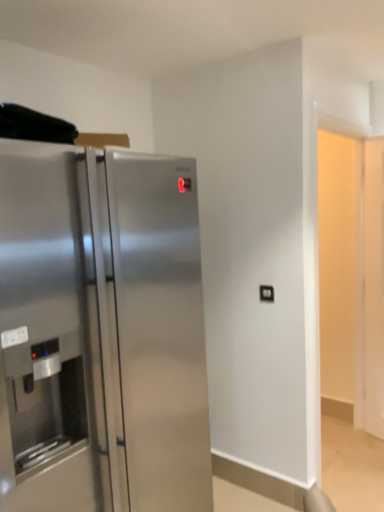
Question: In terms of width, does black plastic outlet at center look wider or thinner when compared to stainless steel refrigerator at left?

Choices:
 (A) wide
 (B) thin

Answer: (B)

Question: Is black plastic outlet at center inside the boundaries of stainless steel refrigerator at left, or outside?

Choices:
 (A) outside
 (B) inside

Answer: (A)

Question: From their relative heights in the image, would you say black plastic outlet at center is taller or shorter than stainless steel refrigerator at left?

Choices:
 (A) tall
 (B) short

Answer: (B)

Question: In terms of size, does stainless steel refrigerator at left appear bigger or smaller than black plastic outlet at center?

Choices:
 (A) small
 (B) big

Answer: (B)

Question: Is point [x=107, y=197] positioned closer to the camera than point [x=271, y=296]?

Choices:
 (A) closer
 (B) farther

Answer: (A)

Question: From their relative heights in the image, would you say stainless steel refrigerator at left is taller or shorter than black plastic outlet at center?

Choices:
 (A) tall
 (B) short

Answer: (A)

Question: Relative to black plastic outlet at center, is stainless steel refrigerator at left in front or behind?

Choices:
 (A) front
 (B) behind

Answer: (A)